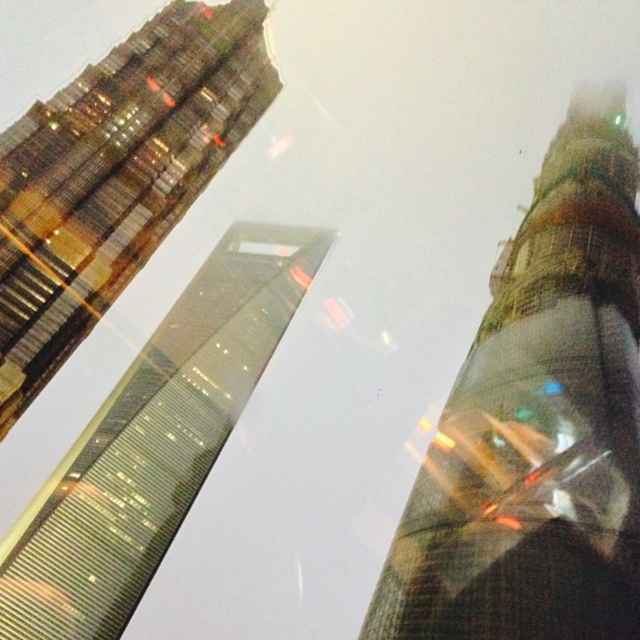
How far apart are translucent glass tower at center and glassy reflective skyscraper at upper left?

235.26 feet

Is translucent glass tower at center smaller than glassy reflective skyscraper at upper left?

Actually, translucent glass tower at center might be larger than glassy reflective skyscraper at upper left.

Is point (557, 154) in front of point (113, 211)?

No.

Where is `translucent glass tower at center`? translucent glass tower at center is located at coordinates (538, 422).

Does glassy reflective skyscraper at upper left lie behind reflective glass skyscraper at center?

That is False.

Measure the distance from glassy reflective skyscraper at upper left to reflective glass skyscraper at center.

glassy reflective skyscraper at upper left and reflective glass skyscraper at center are 213.10 meters apart from each other.

At what (x,y) coordinates should I click in order to perform the action: click on glassy reflective skyscraper at upper left. Please return your answer as a coordinate pair (x, y). The height and width of the screenshot is (640, 640). Looking at the image, I should click on (115, 176).

Which is in front, point (625, 586) or point (129, 573)?

Point (625, 586) is in front.

Where is `translucent glass tower at center`? This screenshot has height=640, width=640. translucent glass tower at center is located at coordinates (x=538, y=422).